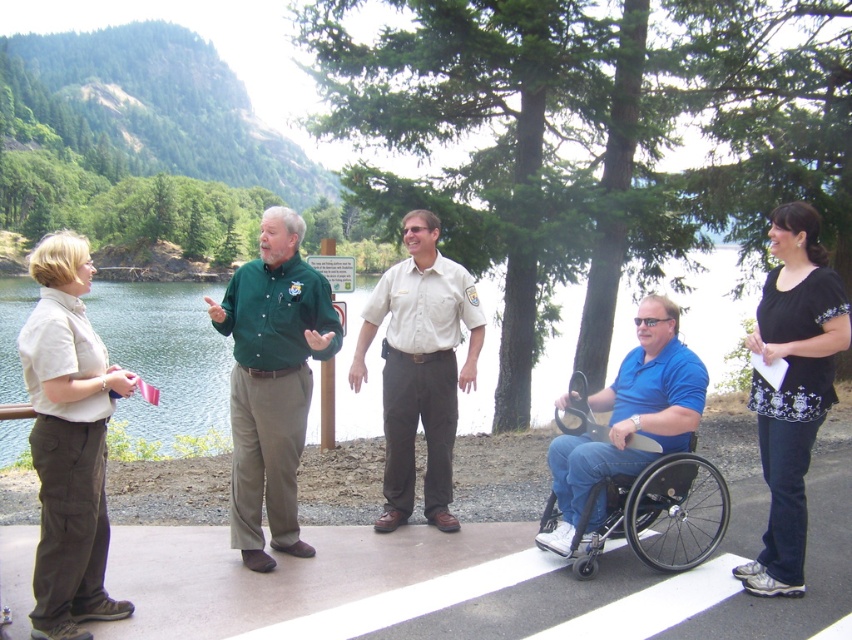
Which is behind, point (56, 636) or point (393, 369)?

Positioned behind is point (393, 369).

Is khaki cotton pants at left wider than beige uniform shirt at center?

Correct, the width of khaki cotton pants at left exceeds that of beige uniform shirt at center.

Between point (59, 410) and point (375, 298), which one is positioned in front?

Positioned in front is point (59, 410).

This screenshot has width=852, height=640. I want to click on khaki cotton pants at left, so click(68, 442).

Is clear water at left shorter than khaki cotton pants at left?

No, clear water at left is not shorter than khaki cotton pants at left.

Where is `clear water at left`? clear water at left is located at coordinates (165, 355).

At what (x,y) coordinates should I click in order to perform the action: click on clear water at left. Please return your answer as a coordinate pair (x, y). The height and width of the screenshot is (640, 852). Looking at the image, I should click on (165, 355).

Can you confirm if khaki cotton pants at left is positioned below green shirt at center?

Yes, khaki cotton pants at left is below green shirt at center.

Which is in front, point (75, 280) or point (306, 554)?

Positioned in front is point (75, 280).

Is point (95, 614) closer to camera compared to point (229, 324)?

Yes, it is.

I want to click on khaki cotton pants at left, so click(68, 442).